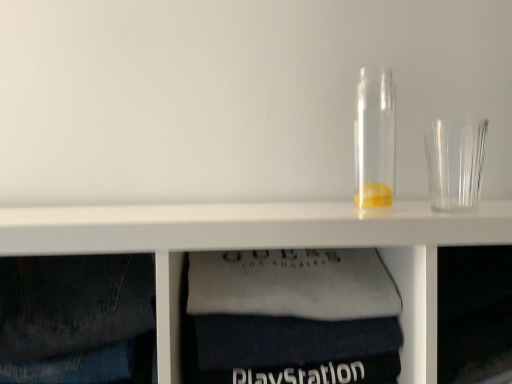
Question: Is transparent plastic shot glass at right outside of white fabric at lower center?

Choices:
 (A) no
 (B) yes

Answer: (B)

Question: Considering the relative sizes of transparent plastic shot glass at right and white fabric at lower center in the image provided, is transparent plastic shot glass at right smaller than white fabric at lower center?

Choices:
 (A) no
 (B) yes

Answer: (B)

Question: Is transparent plastic shot glass at right aimed at white fabric at lower center?

Choices:
 (A) no
 (B) yes

Answer: (A)

Question: Is transparent plastic shot glass at right at the left side of white fabric at lower center?

Choices:
 (A) yes
 (B) no

Answer: (B)

Question: Considering the relative sizes of transparent plastic shot glass at right and white fabric at lower center in the image provided, is transparent plastic shot glass at right bigger than white fabric at lower center?

Choices:
 (A) yes
 (B) no

Answer: (B)

Question: Is white fabric at lower center a part of transparent plastic shot glass at right?

Choices:
 (A) yes
 (B) no

Answer: (B)

Question: Is white fabric at lower center further to camera compared to transparent plastic shot glass at right?

Choices:
 (A) yes
 (B) no

Answer: (B)

Question: From a real-world perspective, does white fabric at lower center sit lower than transparent plastic shot glass at right?

Choices:
 (A) no
 (B) yes

Answer: (B)

Question: Can you confirm if white fabric at lower center is bigger than transparent plastic shot glass at right?

Choices:
 (A) no
 (B) yes

Answer: (B)

Question: Is white fabric at lower center touching transparent plastic shot glass at right?

Choices:
 (A) yes
 (B) no

Answer: (B)

Question: Can you confirm if white fabric at lower center is shorter than transparent plastic shot glass at right?

Choices:
 (A) yes
 (B) no

Answer: (B)

Question: Is white fabric at lower center at the right side of transparent plastic shot glass at right?

Choices:
 (A) yes
 (B) no

Answer: (B)

Question: Does transparent glass jar at center turn towards transparent plastic shot glass at right?

Choices:
 (A) yes
 (B) no

Answer: (B)